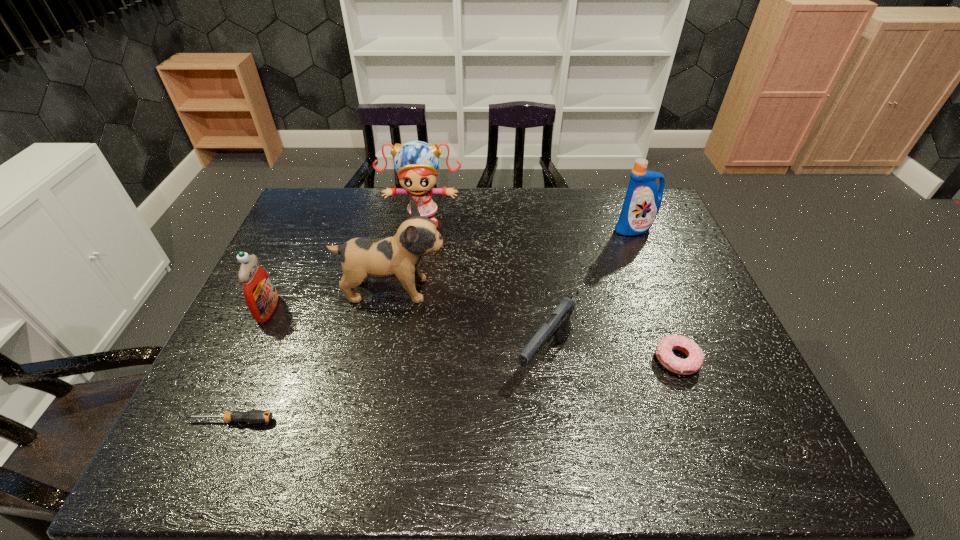
Identify which object is the fifth closest to the doughnut. Please provide its 2D coordinates. Your answer should be formatted as a tuple, i.e. [(x, y)], where the tuple contains the x and y coordinates of a point satisfying the conditions above.

[(253, 416)]

Where is `free space that satisfies the following two spatial constraints: 1. on the label of the taller detergent; 2. at the face of the puppy`? free space that satisfies the following two spatial constraints: 1. on the label of the taller detergent; 2. at the face of the puppy is located at coordinates (659, 290).

You are a GUI agent. You are given a task and a screenshot of the screen. Output one action in this format:
    pyautogui.click(x=<x>, y=<y>)
    Task: Click on the free space in the image that satisfies the following two spatial constraints: 1. on the face of the doll; 2. at the face of the puppy
    
    Given the screenshot: What is the action you would take?
    pyautogui.click(x=412, y=290)

You are a GUI agent. You are given a task and a screenshot of the screen. Output one action in this format:
    pyautogui.click(x=<x>, y=<y>)
    Task: Click on the vacant space that satisfies the following two spatial constraints: 1. on the label of the right detergent; 2. at the face of the puppy
    This screenshot has height=540, width=960.
    Given the screenshot: What is the action you would take?
    pyautogui.click(x=659, y=290)

Locate an element on the screen. This screenshot has height=540, width=960. vacant area that satisfies the following two spatial constraints: 1. on the front surface of the screwdriver; 2. on the left side of the shorter detergent is located at coordinates (216, 420).